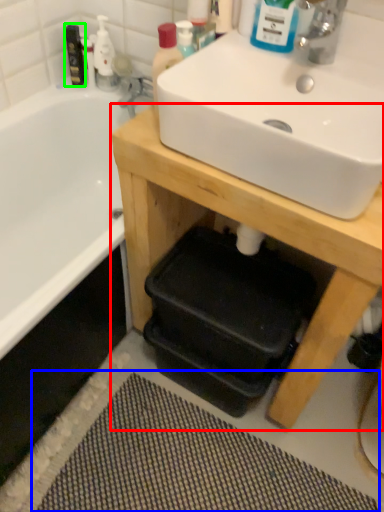
Question: Which object is the farthest from table (highlighted by a red box)? Choose among these: bath mat (highlighted by a blue box) or mouthwash (highlighted by a green box).

Choices:
 (A) bath mat
 (B) mouthwash

Answer: (B)